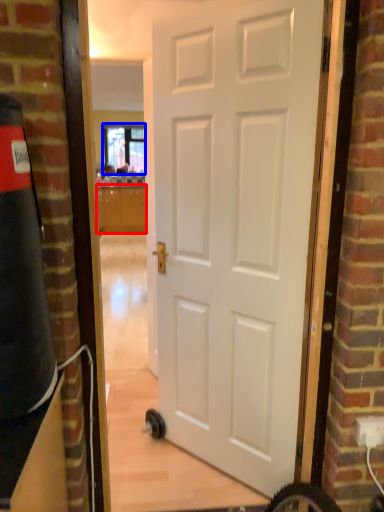
Question: Which object is closer to the camera taking this photo, cabinetry (highlighted by a red box) or window (highlighted by a blue box)?

Choices:
 (A) cabinetry
 (B) window

Answer: (A)